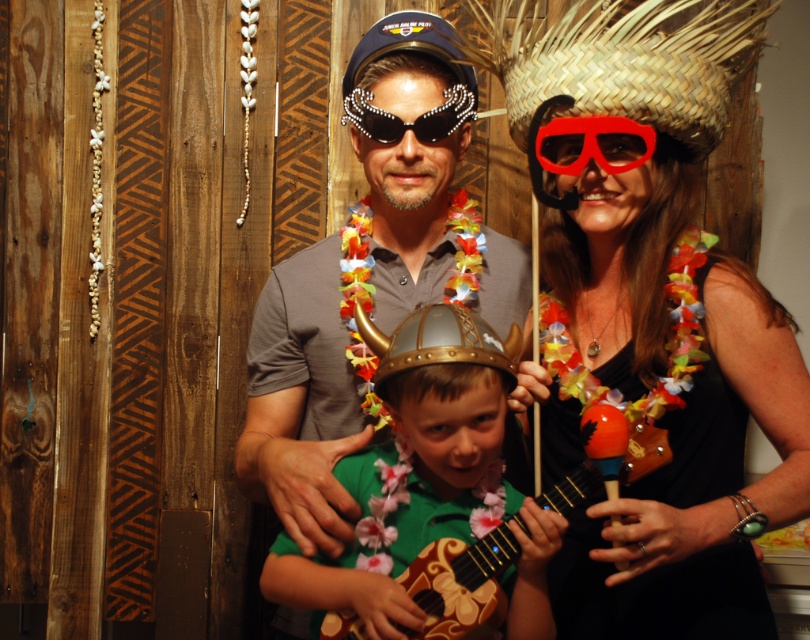
You are a photographer adjusting your camera to focus on two points in the scene. The first point is at coordinates point [616,129] and the second is at point [429,131]. Which point should you focus on first if you want to capture the closest one to the camera?

Point [616,129] is closer to the camera than point [429,131], so you should focus on point [616,129] first.